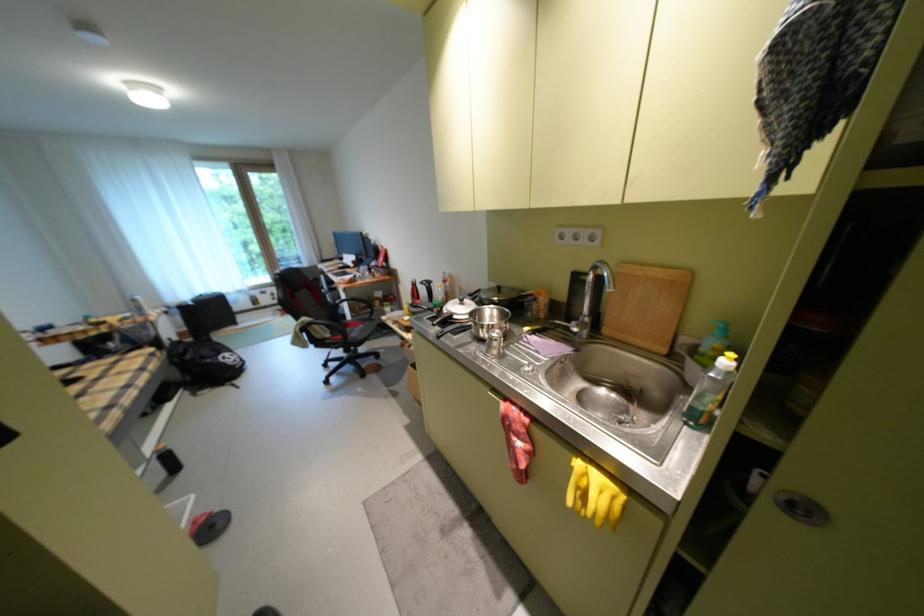
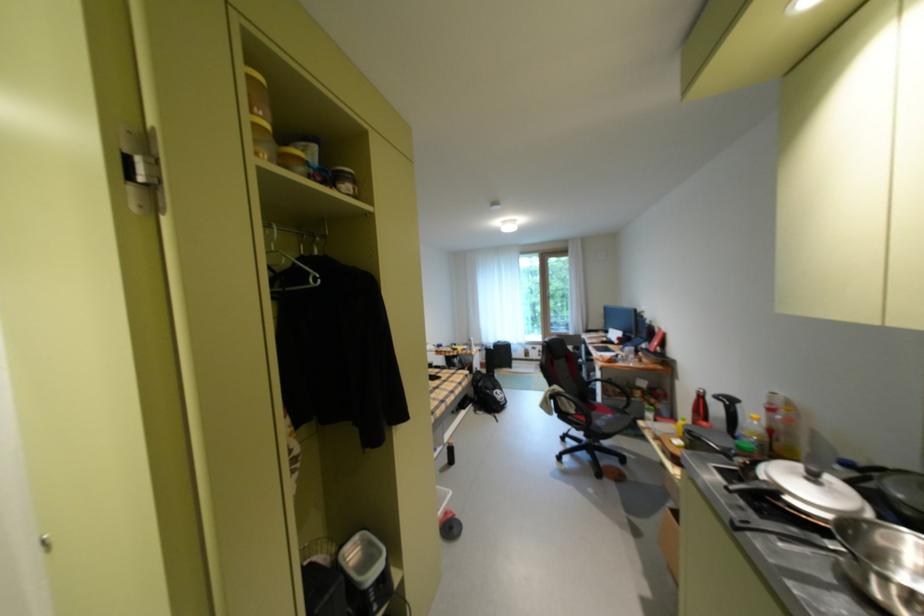
Find the pixel in the second image that matches the point at 482,339 in the first image.

(849, 581)